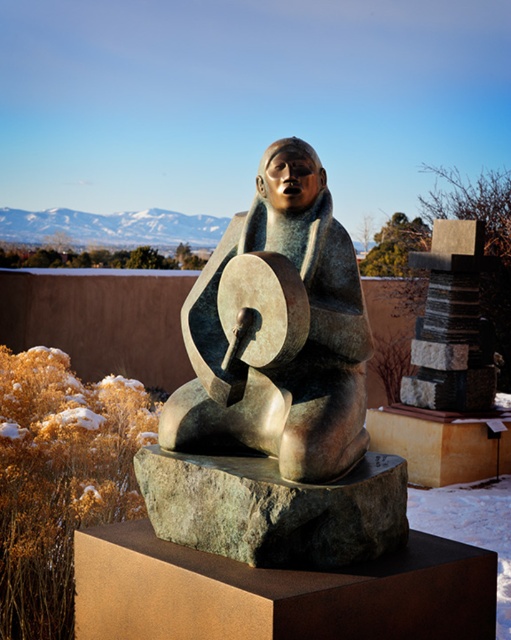
You are an art curator planning to move the bronze statue at center and the green rough stone at center to a new exhibition space. The new space has a narrow doorway that is 1.2 meters wide. Which object will you move first to ensure it fits through the doorway?

The bronze statue at center has a lesser width compared to green rough stone at center, so you should move the bronze statue at center first since it is narrower and more likely to fit through the 1.2 meter wide doorway.

You are a tour guide explaining the sculpture to visitors. You want to mention the distance between the bronze statue at center and the green rough stone at center. How far apart are they?

The bronze statue at center is 11.58 inches away from the green rough stone at center.

You are standing in front of a bronze sculpture of a seated figure holding a drum. The sculpture is on a stone base. There is a point marked at coordinates [276,392]. Can you tell me what this point indicates?

The point at coordinates [276,392] marks the bronze statue at center.